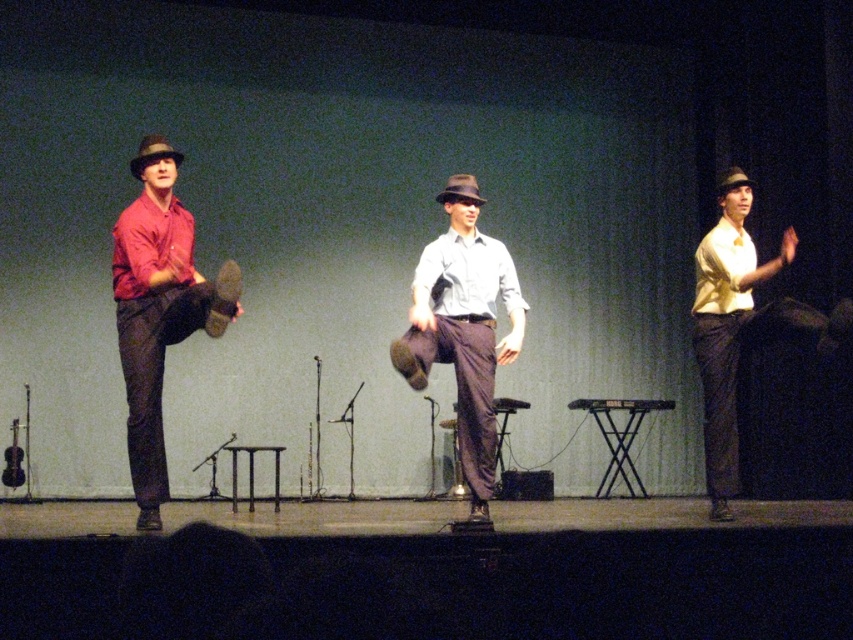
Looking at this image, you are a costume designer preparing for a play. You need to ensure that the matte yellow shirt at right and the matte brown fedora at center are proportionate for the actor. Based on the image, which item is larger in size?

The matte yellow shirt at right is larger in size compared to the matte brown fedora at center according to the description.

You are a stagehand preparing to place a prop on the stage. The prop needs to be placed exactly between the matte red shirt at left and the light shirt in the center. What are the coordinates of the midpoint between them?

The midpoint between the matte red shirt at left and the light shirt in the center is calculated by averaging their coordinates. The coordinates of the matte red shirt at left are given as point A at (158, 308), and the light shirt in the center is at point B at (182, 328). The midpoint would be at the average of the x and y coordinates of both points. The midpoint coordinates are therefore x_avg, y_avg. To calculate this, add the x values of both points and divide by 2, then do the same for the y. The

You are sitting in the audience and want to see both the matte gray shirt at center and the matte yellow shirt at right clearly. Which one is closer to you?

The matte gray shirt at center is closer to you since it is in front of the matte yellow shirt at right.